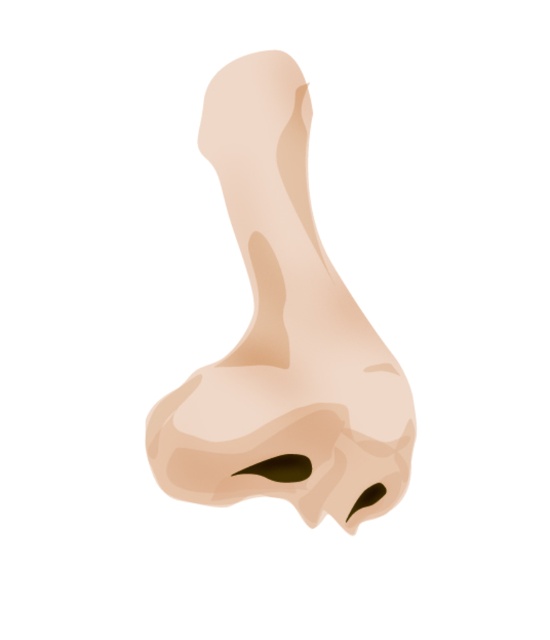
Question: Which of the following is the closest to the observer?

Choices:
 (A) (207, 392)
 (B) (308, 465)
 (C) (358, 504)

Answer: (A)

Question: Does matte beige nose at center have a smaller size compared to black matte nostril at center?

Choices:
 (A) no
 (B) yes

Answer: (A)

Question: Is matte black nostril at center below black matte nostril at center?

Choices:
 (A) yes
 (B) no

Answer: (B)

Question: Does matte beige nose at center appear under black matte nostril at center?

Choices:
 (A) no
 (B) yes

Answer: (A)

Question: Among these points, which one is nearest to the camera?

Choices:
 (A) (341, 500)
 (B) (375, 502)

Answer: (A)

Question: Estimate the real-world distances between objects in this image. Which object is closer to the matte black nostril at center?

Choices:
 (A) black matte nostril at center
 (B) matte beige nose at center

Answer: (A)